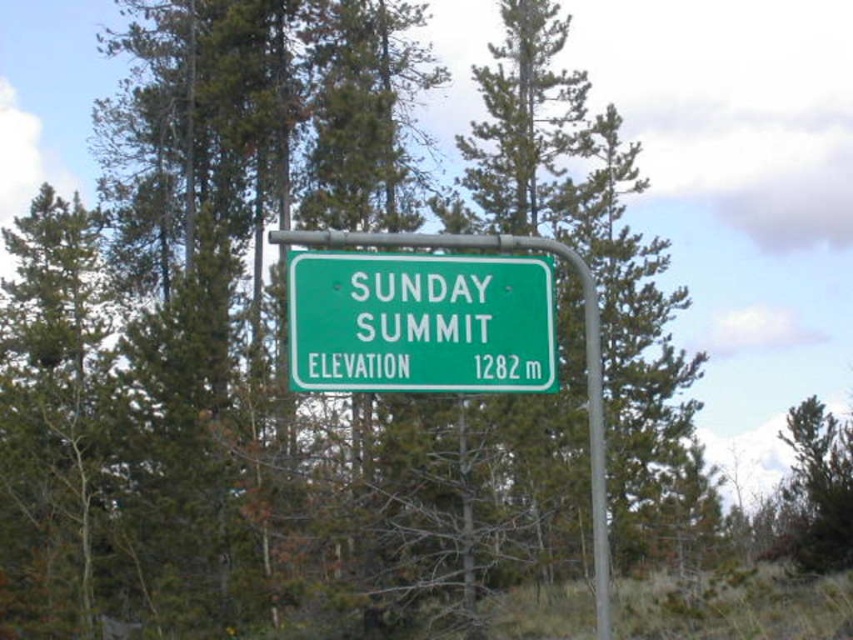
In the scene shown: Which of these two, green matte sign at center or green pine tree at center, stands taller?

Standing taller between the two is green pine tree at center.

Can you confirm if green matte sign at center is positioned below green pine tree at center?

Incorrect, green matte sign at center is not positioned below green pine tree at center.

The width and height of the screenshot is (853, 640). What do you see at coordinates (421, 323) in the screenshot? I see `green matte sign at center` at bounding box center [421, 323].

Identify the location of green matte sign at center. The width and height of the screenshot is (853, 640). (421, 323).